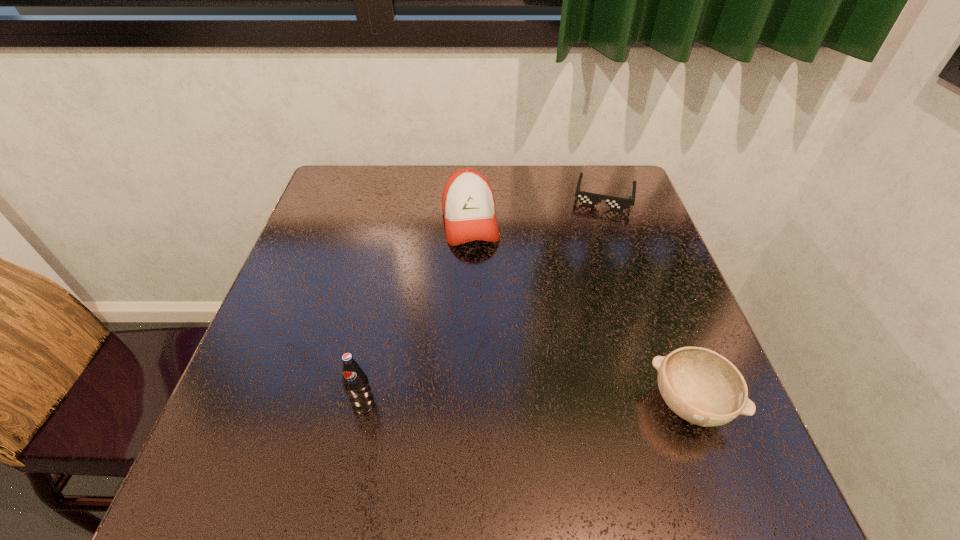
At what (x,y) coordinates should I click in order to perform the action: click on free area in between the sunglasses and the pop. Please return your answer as a coordinate pair (x, y). Looking at the image, I should click on (484, 300).

This screenshot has width=960, height=540. Find the location of `vacant area that lies between the sunglasses and the baseball cap`. vacant area that lies between the sunglasses and the baseball cap is located at coordinates (538, 209).

Where is `free space between the shortest object and the bowl`? Image resolution: width=960 pixels, height=540 pixels. free space between the shortest object and the bowl is located at coordinates (647, 300).

Locate an element on the screen. vacant area between the third tallest object and the sunglasses is located at coordinates (647, 300).

You are a GUI agent. You are given a task and a screenshot of the screen. Output one action in this format:
    pyautogui.click(x=<x>, y=<y>)
    Task: Click on the unoccupied area between the bowl and the baseball cap
    
    Given the screenshot: What is the action you would take?
    pyautogui.click(x=580, y=313)

I want to click on vacant space in between the pop and the shortest object, so click(484, 300).

The height and width of the screenshot is (540, 960). Find the location of `free space between the leftmost object and the second object from left to right`. free space between the leftmost object and the second object from left to right is located at coordinates (417, 313).

Where is `the closest object to the leftmost object`? The width and height of the screenshot is (960, 540). the closest object to the leftmost object is located at coordinates (468, 204).

You are a GUI agent. You are given a task and a screenshot of the screen. Output one action in this format:
    pyautogui.click(x=<x>, y=<y>)
    Task: Click on the object that can be found as the third closest to the leftmost object
    The width and height of the screenshot is (960, 540).
    Given the screenshot: What is the action you would take?
    pyautogui.click(x=590, y=199)